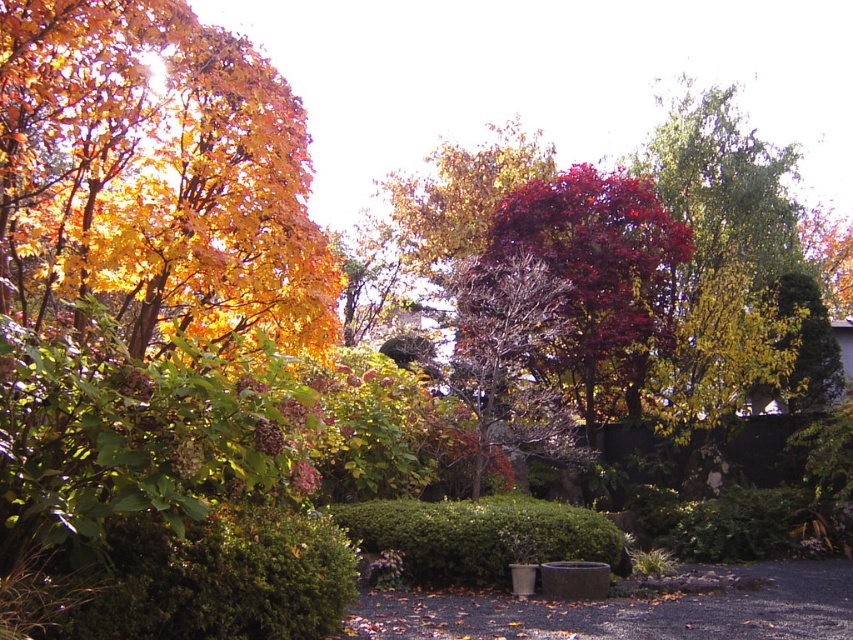
Which is below, green textured hedge at lower left or green matte hedge at center?

green matte hedge at center

Does point (225, 531) lie behind point (511, 508)?

No, (225, 531) is closer to viewer.

What do you see at coordinates (221, 579) in the screenshot? The height and width of the screenshot is (640, 853). I see `green textured hedge at lower left` at bounding box center [221, 579].

Identify the location of green textured hedge at lower left. The image size is (853, 640). (221, 579).